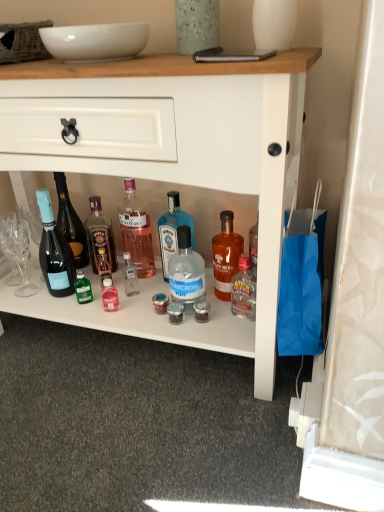
Question: Is point (231, 237) closer or farther from the camera than point (107, 252)?

Choices:
 (A) closer
 (B) farther

Answer: (A)

Question: In terms of height, does matte orange glass bottle at center, acting as the sixth bottle starting from the left, look taller or shorter compared to translucent glass bottle at center, arranged as the 2th bottle when viewed from the left?

Choices:
 (A) tall
 (B) short

Answer: (B)

Question: Which of these objects is positioned closest to the matte orange glass bottle at center, acting as the sixth bottle starting from the left?

Choices:
 (A) blue glass bottle at center, acting as the 3th bottle starting from the right
 (B) speckled glass vase at upper center, which appears as the 2th glass vase when viewed from the right
 (C) clear glass bottle at center, which is the second bottle from right to left
 (D) pink glass bottle at center, which is counted as the 4th bottle, starting from the right
 (E) white glossy bowl at upper center

Answer: (C)

Question: Estimate the real-world distances between objects in this image. Which object is closer to the clear glass bottle at center, which is the second bottle from right to left?

Choices:
 (A) translucent glass bottle at center, which is the 5th bottle in right-to-left order
 (B) speckled glass vase at upper center, which appears as the 2th glass vase when viewed from the right
 (C) white glossy vase at upper center, the first glass vase in the right-to-left sequence
 (D) pink glass bottle at center, which is counted as the third bottle, starting from the left
 (E) white glossy cabinet at center

Answer: (D)